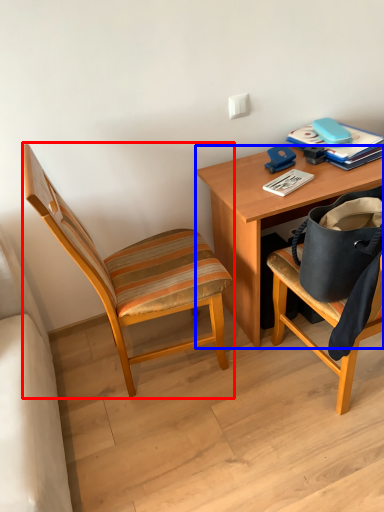
Question: Which point is further to the camera, chair (highlighted by a red box) or desk (highlighted by a blue box)?

Choices:
 (A) chair
 (B) desk

Answer: (B)